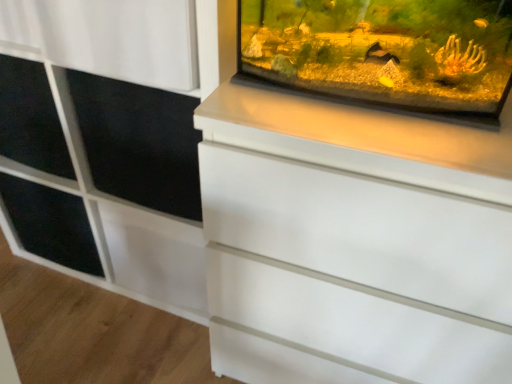
Question: Considering the positions of black matte screen door at upper left and transparent glass tank at upper right in the image, is black matte screen door at upper left wider or thinner than transparent glass tank at upper right?

Choices:
 (A) thin
 (B) wide

Answer: (B)

Question: Is black matte screen door at upper left taller or shorter than transparent glass tank at upper right?

Choices:
 (A) short
 (B) tall

Answer: (B)

Question: Estimate the real-world distances between objects in this image. Which object is farther from the black matte shelf at left?

Choices:
 (A) black matte screen door at upper left
 (B) white matte cabinet at upper right
 (C) transparent glass tank at upper right

Answer: (C)

Question: Estimate the real-world distances between objects in this image. Which object is closer to the transparent glass tank at upper right?

Choices:
 (A) white matte cabinet at upper right
 (B) black matte screen door at upper left
 (C) black matte shelf at left

Answer: (B)